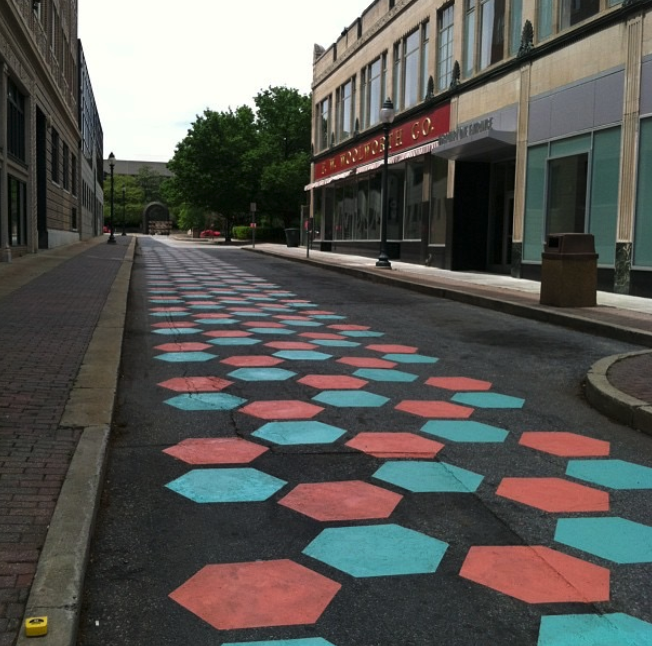
Where is `archway`? archway is located at coordinates point(158,203).